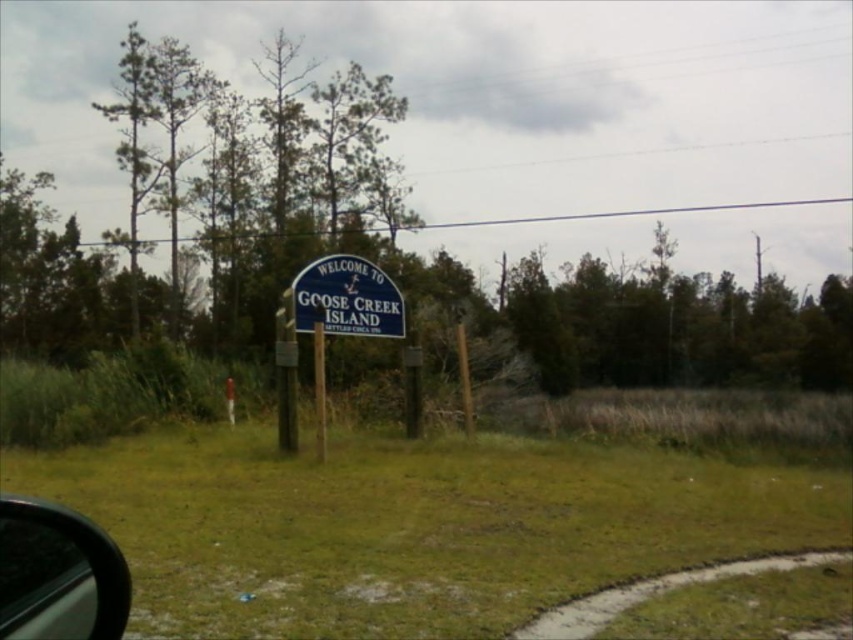
Is point (12, 506) behind point (315, 387)?

No, it is not.

Between transparent glass car window at lower left and wooden post at center, which one appears on the left side from the viewer's perspective?

Positioned to the left is wooden post at center.

I want to click on transparent glass car window at lower left, so click(57, 573).

Between transparent glass car window at lower left and blue painted wood sign at center, which one has more height?

blue painted wood sign at center

Can you confirm if transparent glass car window at lower left is positioned above blue painted wood sign at center?

No, transparent glass car window at lower left is not above blue painted wood sign at center.

This screenshot has width=853, height=640. Find the location of `transparent glass car window at lower left`. transparent glass car window at lower left is located at coordinates (57, 573).

Who is shorter, blue painted wood sign at center or wooden post at center?

Standing shorter between the two is blue painted wood sign at center.

Identify the location of blue painted wood sign at center. (347, 298).